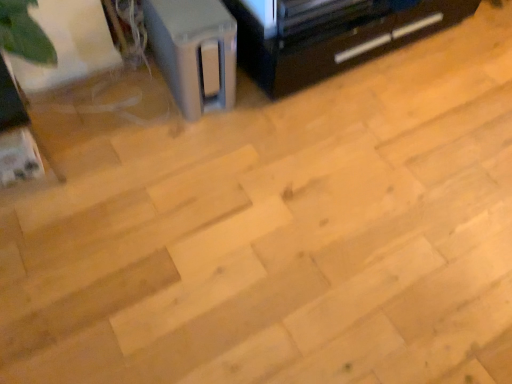
Question: Visually, is satin gray speaker at upper left positioned to the left or to the right of black plastic tv stand at upper right?

Choices:
 (A) left
 (B) right

Answer: (A)

Question: Is satin gray speaker at upper left spatially inside black plastic tv stand at upper right, or outside of it?

Choices:
 (A) inside
 (B) outside

Answer: (B)

Question: Is satin gray speaker at upper left in front of or behind black plastic tv stand at upper right in the image?

Choices:
 (A) front
 (B) behind

Answer: (A)

Question: Is black plastic tv stand at upper right wider or thinner than satin gray speaker at upper left?

Choices:
 (A) wide
 (B) thin

Answer: (B)

Question: Considering the positions of black plastic tv stand at upper right and satin gray speaker at upper left in the image, is black plastic tv stand at upper right taller or shorter than satin gray speaker at upper left?

Choices:
 (A) tall
 (B) short

Answer: (B)

Question: Which is correct: black plastic tv stand at upper right is inside satin gray speaker at upper left, or outside of it?

Choices:
 (A) inside
 (B) outside

Answer: (B)

Question: Is black plastic tv stand at upper right to the left or to the right of satin gray speaker at upper left in the image?

Choices:
 (A) right
 (B) left

Answer: (A)